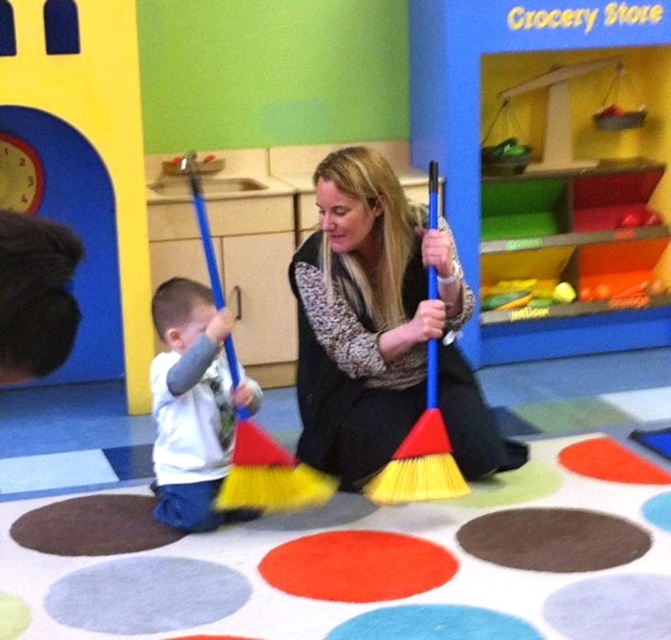
Does white soft shirt at lower left appear over yellow-bristled broom at center?

No.

Which is in front, point (199, 365) or point (417, 477)?

Point (199, 365) is more forward.

Find the location of `white soft shirt at lower left`. white soft shirt at lower left is located at coordinates (191, 404).

Is matte blue broom at center to the left of white soft shirt at lower left from the viewer's perspective?

In fact, matte blue broom at center is to the right of white soft shirt at lower left.

Does matte blue broom at center have a greater width compared to white soft shirt at lower left?

Yes.

You are a GUI agent. You are given a task and a screenshot of the screen. Output one action in this format:
    pyautogui.click(x=<x>, y=<y>)
    Task: Click on the matte blue broom at center
    The width and height of the screenshot is (671, 640).
    Given the screenshot: What is the action you would take?
    pyautogui.click(x=380, y=330)

Image resolution: width=671 pixels, height=640 pixels. Identify the location of matte blue broom at center. (380, 330).

Does matte blue broom at center have a larger size compared to yellow-bristled broom at center?

Yes.

Does matte blue broom at center appear under yellow-bristled broom at center?

Actually, matte blue broom at center is above yellow-bristled broom at center.

Who is more forward, (380, 241) or (454, 490)?

Point (454, 490) is in front.

The image size is (671, 640). What are the coordinates of `matte blue broom at center` in the screenshot? It's located at pos(380,330).